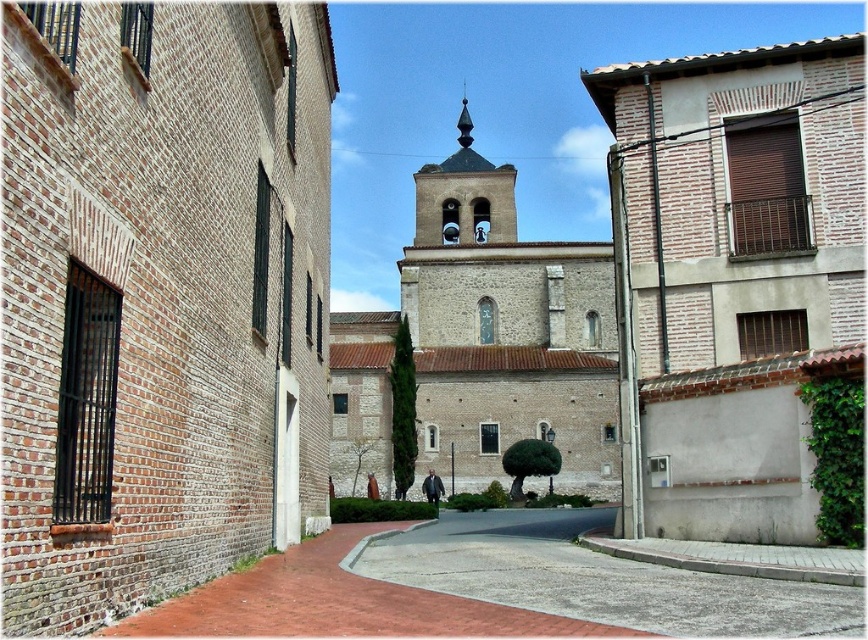
Question: Which point is closer to the camera?

Choices:
 (A) white stone church at center
 (B) gray stone bell tower at center
 (C) brown brick church at center

Answer: (C)

Question: Does white stone church at center have a larger size compared to gray stone bell tower at center?

Choices:
 (A) yes
 (B) no

Answer: (A)

Question: Is white brick church at center closer to the viewer compared to brick pavement at center?

Choices:
 (A) no
 (B) yes

Answer: (A)

Question: Estimate the real-world distances between objects in this image. Which object is closer to the brown brick church at center?

Choices:
 (A) white stone church at center
 (B) brick pavement at center
 (C) gray stone bell tower at center
 (D) white brick church at center

Answer: (B)

Question: Where is white stone church at center located in relation to gray stone bell tower at center in the image?

Choices:
 (A) below
 (B) above

Answer: (A)

Question: Which of these objects is positioned farthest from the white brick church at center?

Choices:
 (A) brick pavement at center
 (B) gray stone bell tower at center
 (C) white stone church at center
 (D) brown brick church at center

Answer: (B)